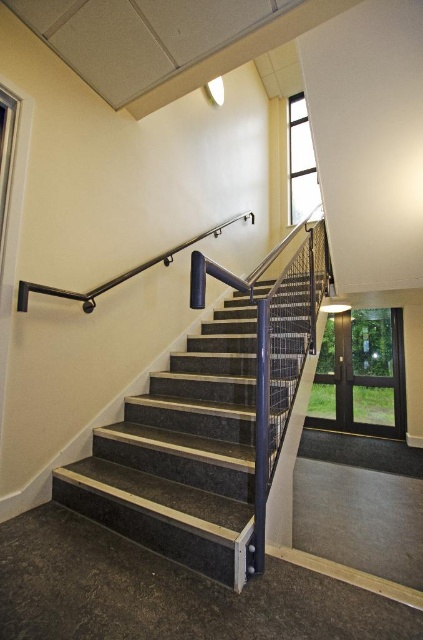
Question: Is the position of marble stairs at center less distant than that of black metal handrail at upper center?

Choices:
 (A) no
 (B) yes

Answer: (B)

Question: Which of the following is the closest to the observer?

Choices:
 (A) marble stairs at center
 (B) black metal handrail at upper center

Answer: (A)

Question: Is marble stairs at center thinner than black metal handrail at upper center?

Choices:
 (A) yes
 (B) no

Answer: (B)

Question: Does marble stairs at center have a lesser width compared to black metal handrail at upper center?

Choices:
 (A) no
 (B) yes

Answer: (A)

Question: Which of the following is the closest to the observer?

Choices:
 (A) (211, 428)
 (B) (71, 296)

Answer: (B)

Question: Which object is closer to the camera taking this photo?

Choices:
 (A) black metal handrail at upper center
 (B) marble stairs at center

Answer: (B)